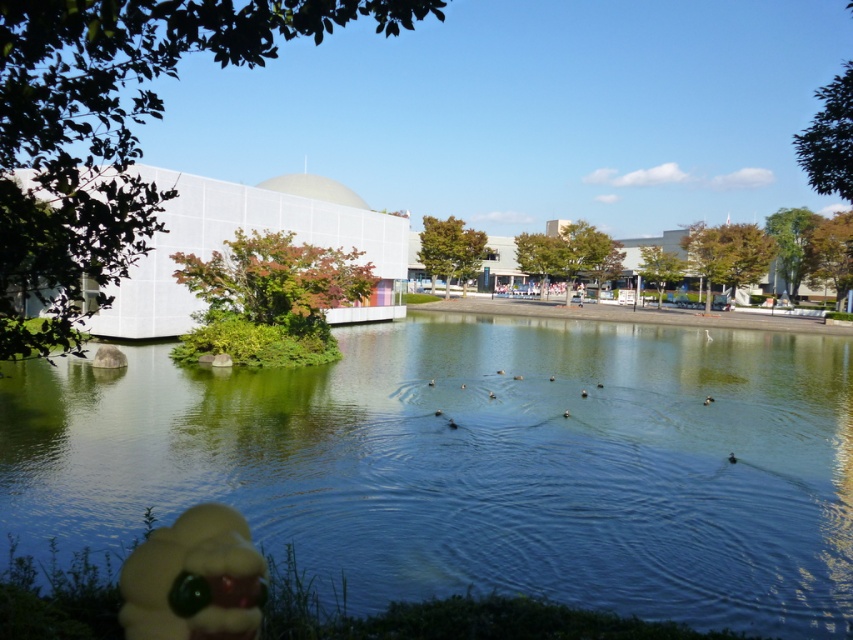
Question: Can you confirm if clear water at pond center is positioned to the right of yellow rubber duck at lower left?

Choices:
 (A) no
 (B) yes

Answer: (B)

Question: Which point appears closest to the camera in this image?

Choices:
 (A) (286, 369)
 (B) (212, 502)

Answer: (B)

Question: Which object appears closest to the camera in this image?

Choices:
 (A) yellow rubber duck at lower left
 (B) clear water at pond center

Answer: (A)

Question: Does clear water at pond center come behind yellow rubber duck at lower left?

Choices:
 (A) yes
 (B) no

Answer: (A)

Question: Does clear water at pond center have a larger size compared to yellow rubber duck at lower left?

Choices:
 (A) yes
 (B) no

Answer: (A)